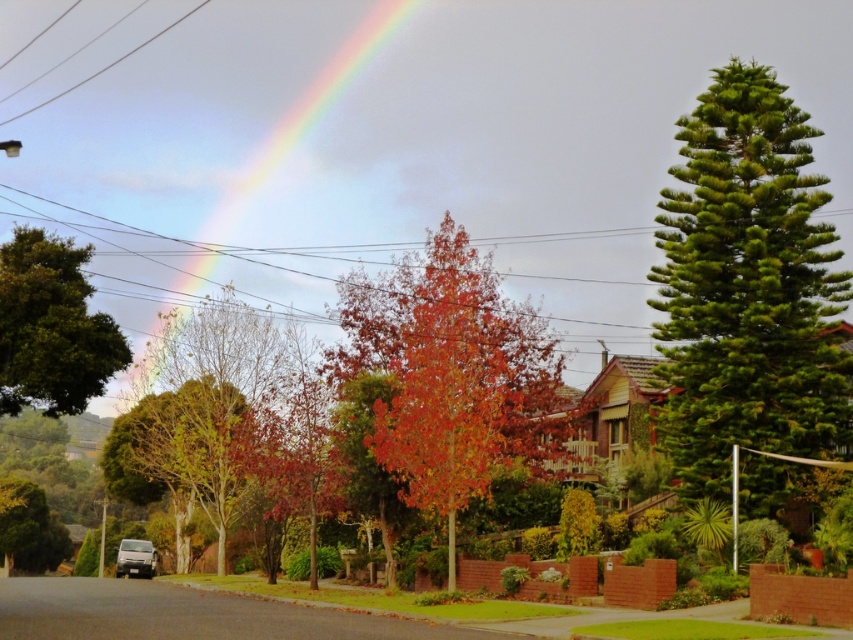
You are a photographer trying to capture the rainbow at upper center and the green leafy tree at left in the same frame. Based on their positions, which object would appear closer to the bottom of your photo?

The green leafy tree at left appears closer to the bottom of the photo because it is located below the rainbow at upper center.

Looking at the suburban scene, you see a green leafy tree at left and a rainbow at upper center. Which object is positioned more to the right side of the image?

The green leafy tree at left is positioned to the right of the rainbow at upper center, so it is more to the right side of the image.